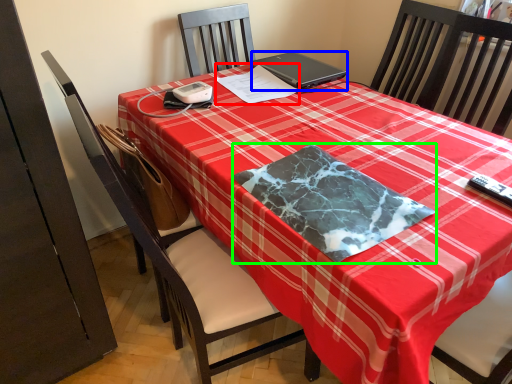
Question: Which object is the closest to the notepad (highlighted by a red box)? Choose among these: laptop (highlighted by a blue box) or blanket (highlighted by a green box).

Choices:
 (A) laptop
 (B) blanket

Answer: (A)